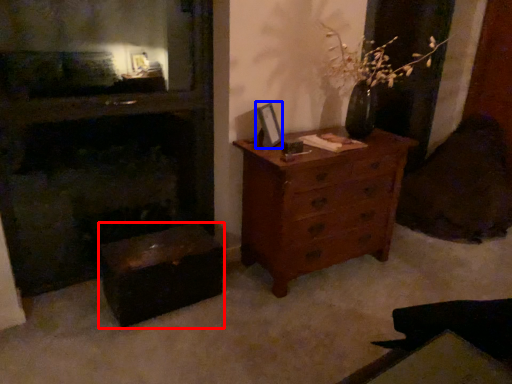
Question: Which point is further to the camera, vanity (highlighted by a red box) or picture frame (highlighted by a blue box)?

Choices:
 (A) vanity
 (B) picture frame

Answer: (B)